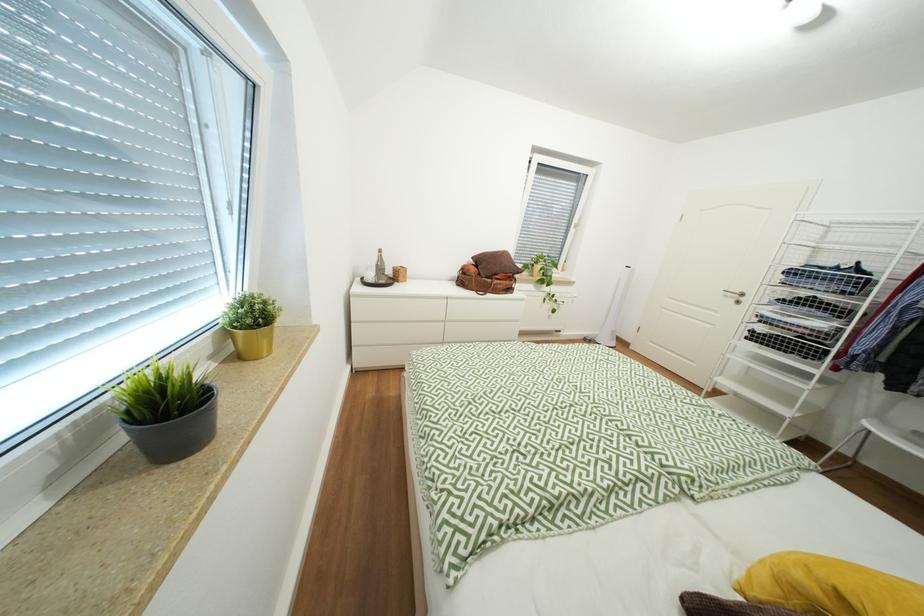
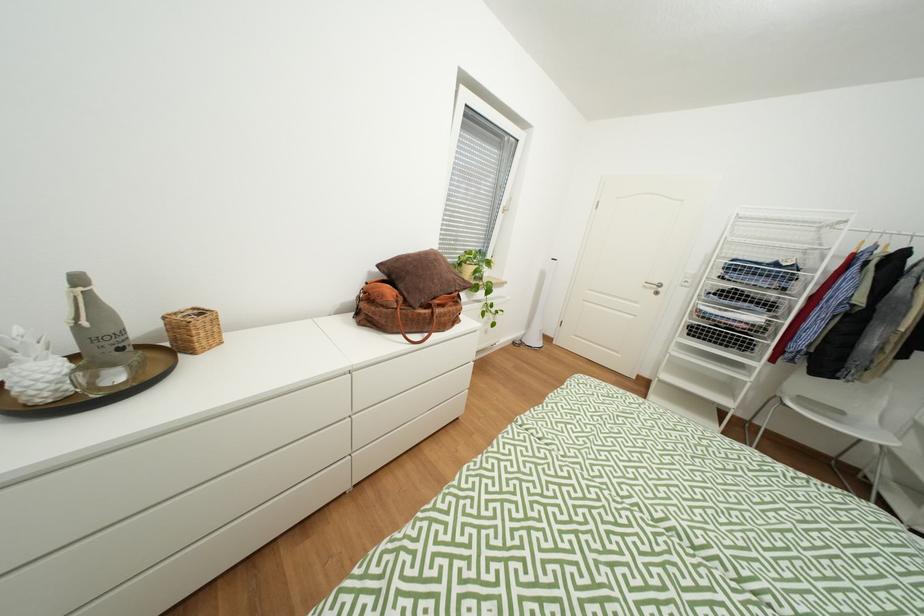
Question: Which direction would the cameraman need to move to produce the second image? Reply with the corresponding letter.

Choices:
 (A) Left
 (B) Right
 (C) Forward
 (D) Backward

Answer: (C)